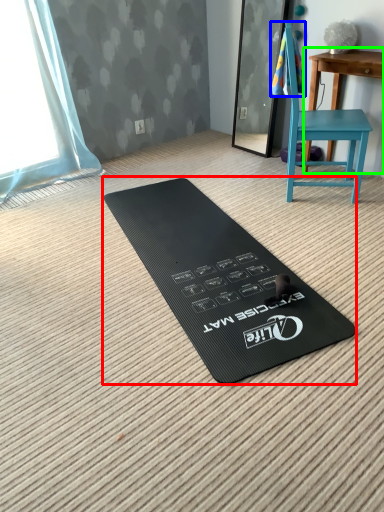
Question: Which is farther away from yoga mat (highlighted by a red box)? beach towel (highlighted by a blue box) or table (highlighted by a green box)?

Choices:
 (A) beach towel
 (B) table

Answer: (B)